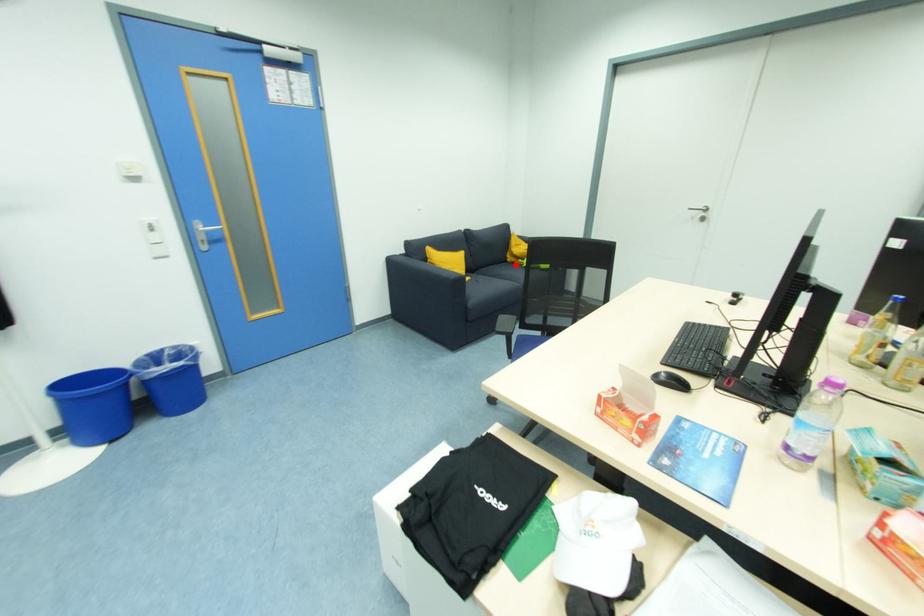
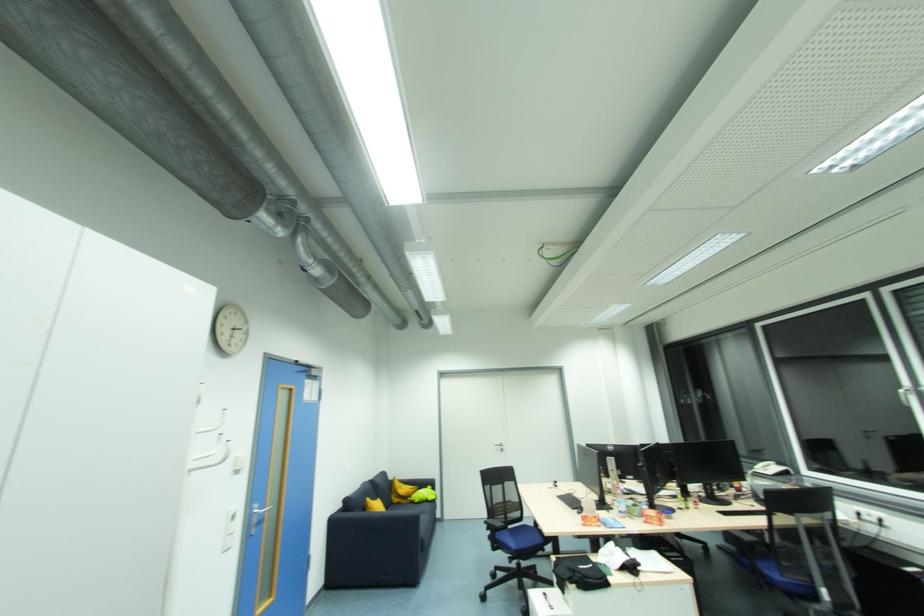
Question: I am providing you with two images of the same scene from different viewpoints. A red point is marked on the first image. Is the red point's position out of view in image 2?

Choices:
 (A) Yes
 (B) No

Answer: (B)